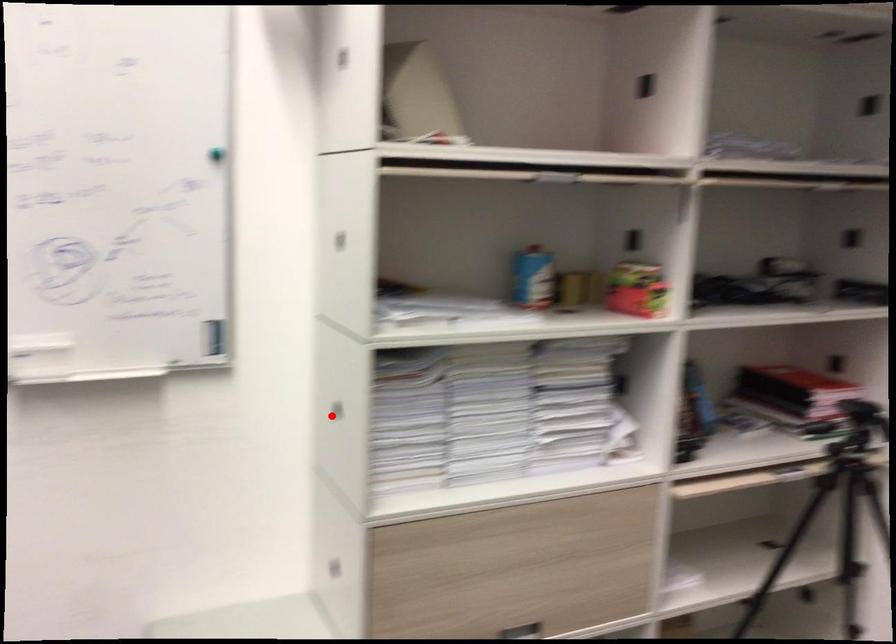
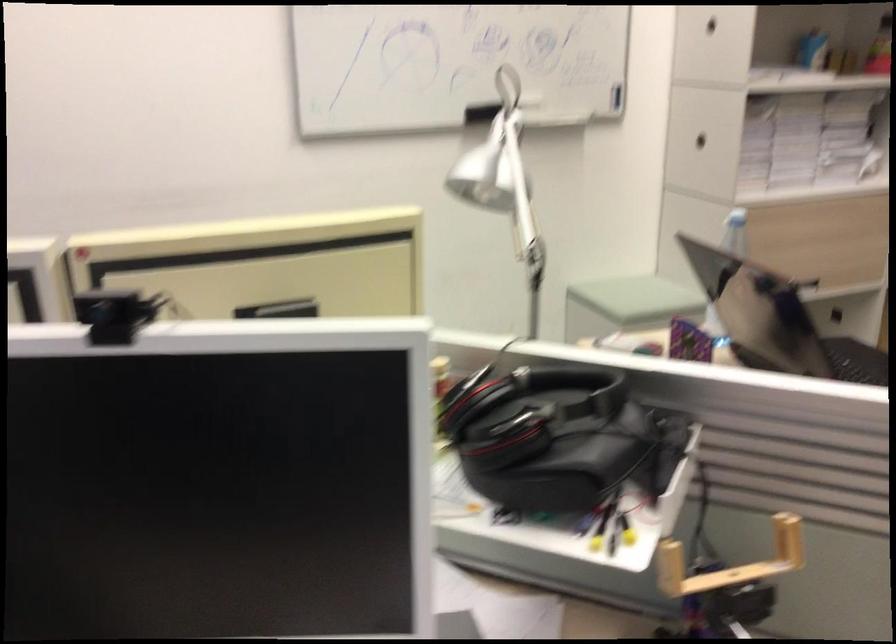
In the second image, find the point that corresponds to the highlighted location in the first image.

(700, 140)